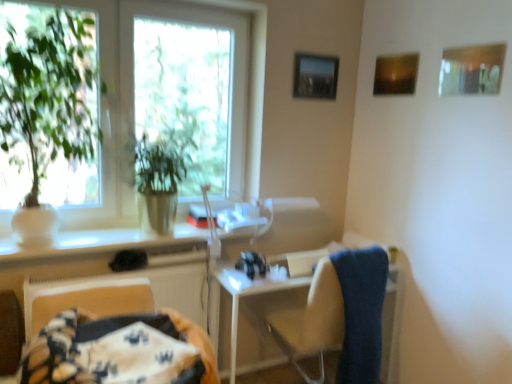
Question: Based on their sizes in the image, would you say green leafy plant at left is bigger or smaller than green matte plant at left?

Choices:
 (A) big
 (B) small

Answer: (B)

Question: From their relative heights in the image, would you say green leafy plant at left is taller or shorter than green matte plant at left?

Choices:
 (A) tall
 (B) short

Answer: (A)

Question: Which object is the closest to the metallic silver picture frame at upper center, which appears as the first picture frame when viewed from the back?

Choices:
 (A) green matte plant at left
 (B) white glossy counter top at center
 (C) fluffy fabric blanket at lower left
 (D) wooden frame at upper right, the 1th picture frame when ordered from right to left
 (E) matte wooden picture frame at upper right, which is counted as the 2th picture frame, starting from the front

Answer: (E)

Question: Based on their relative distances, which object is farther from the white glossy counter top at center?

Choices:
 (A) blue fabric towel at right
 (B) green matte plant at left
 (C) fluffy fabric blanket at lower left
 (D) green leafy plant at left
 (E) wooden frame at upper right, the 3th picture frame from the left

Answer: (E)